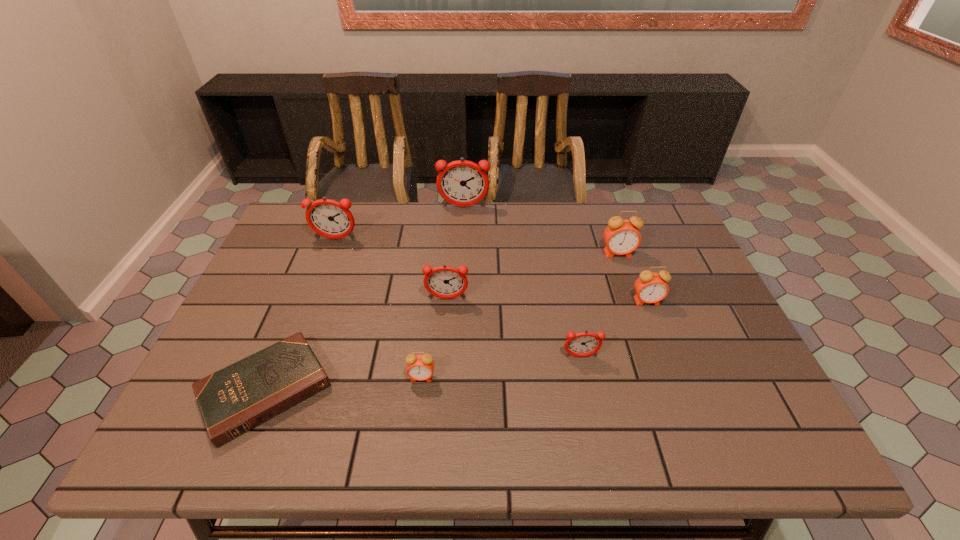
The width and height of the screenshot is (960, 540). In order to click on free space between the green Bible and the farthest pink alarm clock in this screenshot , I will do `click(442, 322)`.

Identify which object is located as the fourth nearest to the farthest pink alarm clock. Please provide its 2D coordinates. Your answer should be formatted as a tuple, i.e. [(x, y)], where the tuple contains the x and y coordinates of a point satisfying the conditions above.

[(445, 282)]

Find the location of a particular element. This screenshot has width=960, height=540. object that stands as the fifth closest to the tallest alarm clock is located at coordinates (236, 399).

Locate which alarm clock is the sixth closest to the second farthest pink alarm clock. Please provide its 2D coordinates. Your answer should be formatted as a tuple, i.e. [(x, y)], where the tuple contains the x and y coordinates of a point satisfying the conditions above.

[(328, 218)]

This screenshot has height=540, width=960. I want to click on alarm clock that is the seventh closest one to the shortest object, so click(621, 236).

The height and width of the screenshot is (540, 960). Find the location of `reddish-pink alarm clock that stands as the closest to the third farthest reddish-pink alarm clock`. reddish-pink alarm clock that stands as the closest to the third farthest reddish-pink alarm clock is located at coordinates (582, 344).

Identify which reddish-pink alarm clock is the second nearest to the second farthest pink alarm clock. Please provide its 2D coordinates. Your answer should be formatted as a tuple, i.e. [(x, y)], where the tuple contains the x and y coordinates of a point satisfying the conditions above.

[(445, 282)]

At what (x,y) coordinates should I click in order to perform the action: click on pink alarm clock that can be found as the closest to the fifth alarm clock from left to right. Please return your answer as a coordinate pair (x, y). Looking at the image, I should click on (650, 287).

Select which pink alarm clock is the third closest to the second smallest reddish-pink alarm clock. Please provide its 2D coordinates. Your answer should be formatted as a tuple, i.e. [(x, y)], where the tuple contains the x and y coordinates of a point satisfying the conditions above.

[(650, 287)]